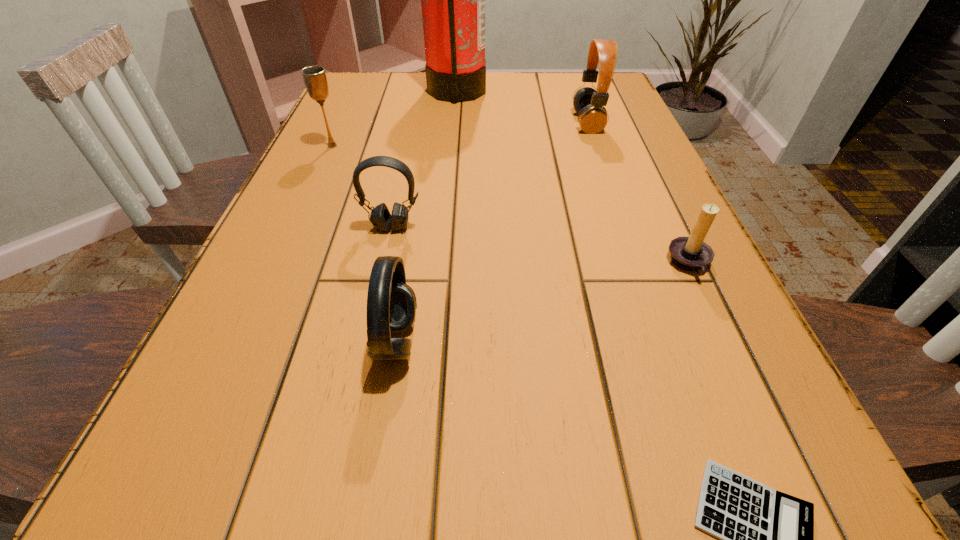
Where is `object located at the left edge`? Image resolution: width=960 pixels, height=540 pixels. object located at the left edge is located at coordinates (314, 77).

Where is `headset that is at the right edge`? Image resolution: width=960 pixels, height=540 pixels. headset that is at the right edge is located at coordinates (588, 103).

Find the location of a particular element. The image size is (960, 540). candle holder that is at the right edge is located at coordinates (690, 253).

This screenshot has width=960, height=540. What are the coordinates of `vacant space at the far edge of the desktop` in the screenshot? It's located at (551, 89).

This screenshot has width=960, height=540. In order to click on free space at the left edge in this screenshot , I will do click(327, 150).

This screenshot has height=540, width=960. Identify the location of blank space at the right edge of the desktop. (591, 137).

The width and height of the screenshot is (960, 540). In the image, there is a desktop. In order to click on vacant region at the far left corner in this screenshot , I will do `click(371, 101)`.

The width and height of the screenshot is (960, 540). In the image, there is a desktop. In order to click on free space at the near left corner in this screenshot , I will do `click(135, 508)`.

I want to click on vacant space that's between the fire extinguisher and the leftmost object, so click(395, 119).

Find the location of a particular element. The image size is (960, 540). free space between the tallest object and the farthest headset is located at coordinates (522, 107).